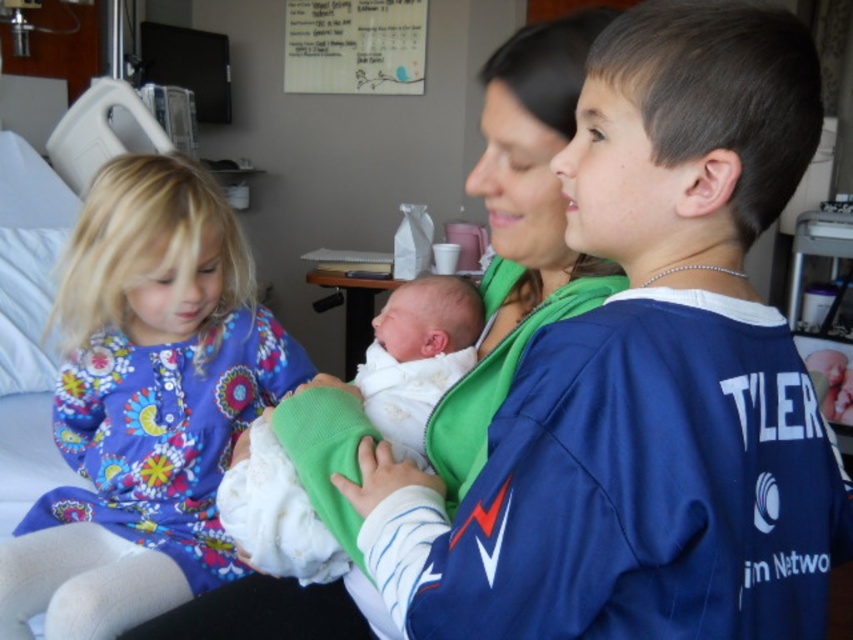
Question: Which object is the farthest from the white soft fabric newborn at center?

Choices:
 (A) white soft swaddled newborn at center
 (B) floral fabric dress at left

Answer: (B)

Question: Which point is closer to the camera?

Choices:
 (A) (393, 419)
 (B) (74, 333)
 (C) (422, 310)

Answer: (A)

Question: Can you confirm if white soft swaddled newborn at center is wider than white soft fabric newborn at center?

Choices:
 (A) yes
 (B) no

Answer: (A)

Question: Is floral fabric dress at left above white soft fabric newborn at center?

Choices:
 (A) yes
 (B) no

Answer: (B)

Question: Is floral fabric dress at left positioned behind white soft swaddled newborn at center?

Choices:
 (A) no
 (B) yes

Answer: (B)

Question: Estimate the real-world distances between objects in this image. Which object is farther from the white soft swaddled newborn at center?

Choices:
 (A) white soft fabric newborn at center
 (B) floral fabric dress at left

Answer: (B)